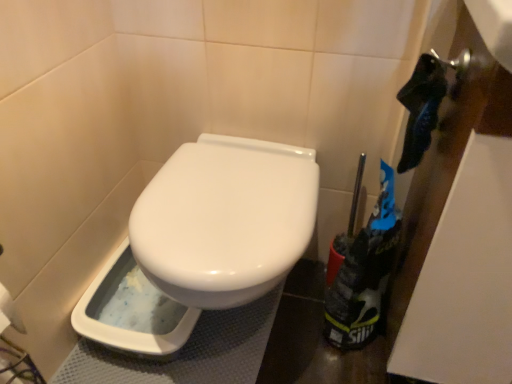
Describe the element at coordinates (132, 312) in the screenshot. I see `white plastic bidet at lower left` at that location.

At what (x,y) coordinates should I click in order to perform the action: click on white plastic bidet at lower left. Please return your answer as a coordinate pair (x, y). Looking at the image, I should click on point(132,312).

Image resolution: width=512 pixels, height=384 pixels. In order to click on black fabric bag at right in this screenshot , I will do pyautogui.click(x=364, y=273).

What do you see at coordinates (364, 273) in the screenshot?
I see `black fabric bag at right` at bounding box center [364, 273].

Image resolution: width=512 pixels, height=384 pixels. In order to click on white plastic bidet at lower left in this screenshot , I will do `click(132, 312)`.

Visually, is black fabric bag at right positioned to the left or to the right of white plastic bidet at lower left?

From the image, it's evident that black fabric bag at right is to the right of white plastic bidet at lower left.

Is black fabric bag at right positioned behind white plastic bidet at lower left?

No, the depth of black fabric bag at right is less than that of white plastic bidet at lower left.

Which is behind, point (359, 261) or point (132, 334)?

The point (132, 334) is more distant.

From the image's perspective, who appears lower, black fabric bag at right or white plastic bidet at lower left?

white plastic bidet at lower left appears lower in the image.

From a real-world perspective, relative to white plastic bidet at lower left, is black fabric bag at right vertically above or below?

black fabric bag at right is situated higher than white plastic bidet at lower left in the real world.

Considering the sizes of objects black fabric bag at right and white plastic bidet at lower left in the image provided, who is wider, black fabric bag at right or white plastic bidet at lower left?

white plastic bidet at lower left is wider.

Looking at this image, can you confirm if black fabric bag at right is shorter than white plastic bidet at lower left?

In fact, black fabric bag at right may be taller than white plastic bidet at lower left.

Which of these two, black fabric bag at right or white plastic bidet at lower left, is bigger?

With larger size is black fabric bag at right.

Would you say white plastic bidet at lower left is part of black fabric bag at right's contents?

No, white plastic bidet at lower left is located outside of black fabric bag at right.

Is the surface of black fabric bag at right in direct contact with white plastic bidet at lower left?

No, black fabric bag at right is not touching white plastic bidet at lower left.

Is black fabric bag at right looking in the opposite direction of white plastic bidet at lower left?

No, black fabric bag at right is not facing the opposite direction of white plastic bidet at lower left.

Can you tell me how much black fabric bag at right and white plastic bidet at lower left differ in facing direction?

There is a 90-degree angle between the facing directions of black fabric bag at right and white plastic bidet at lower left.

Where is `bidet on the left side of black fabric bag at right`? bidet on the left side of black fabric bag at right is located at coordinates (132, 312).

Which is more to the left, white plastic bidet at lower left or black fabric bag at right?

Positioned to the left is white plastic bidet at lower left.

Is white plastic bidet at lower left in front of or behind black fabric bag at right in the image?

Visually, white plastic bidet at lower left is located behind black fabric bag at right.

Which is further, (137,271) or (391,217)?

The point (137,271) is behind.

From the image's perspective, is white plastic bidet at lower left located beneath black fabric bag at right?

Yes, from the image's perspective, white plastic bidet at lower left is below black fabric bag at right.

From a real-world perspective, is white plastic bidet at lower left physically above black fabric bag at right?

No.

Which object is wider, white plastic bidet at lower left or black fabric bag at right?

white plastic bidet at lower left is wider.

From the picture: Can you confirm if white plastic bidet at lower left is taller than black fabric bag at right?

No, white plastic bidet at lower left is not taller than black fabric bag at right.

In terms of size, does white plastic bidet at lower left appear bigger or smaller than black fabric bag at right?

Clearly, white plastic bidet at lower left is smaller in size than black fabric bag at right.

Is white plastic bidet at lower left not within black fabric bag at right?

That's correct, white plastic bidet at lower left is outside of black fabric bag at right.

Is white plastic bidet at lower left placed right next to black fabric bag at right?

No, white plastic bidet at lower left is not making contact with black fabric bag at right.

Is white plastic bidet at lower left facing away from black fabric bag at right?

That's not correct — white plastic bidet at lower left is not looking away from black fabric bag at right.

Consider the image. Can you tell me how much white plastic bidet at lower left and black fabric bag at right differ in facing direction?

The facing directions of white plastic bidet at lower left and black fabric bag at right are 90 degrees apart.

The height and width of the screenshot is (384, 512). Find the location of `garbage in front of the white plastic bidet at lower left`. garbage in front of the white plastic bidet at lower left is located at coordinates (364, 273).

In order to click on garbage in front of the white plastic bidet at lower left in this screenshot , I will do `click(364, 273)`.

Identify the location of bidet below the black fabric bag at right (from a real-world perspective). (132, 312).